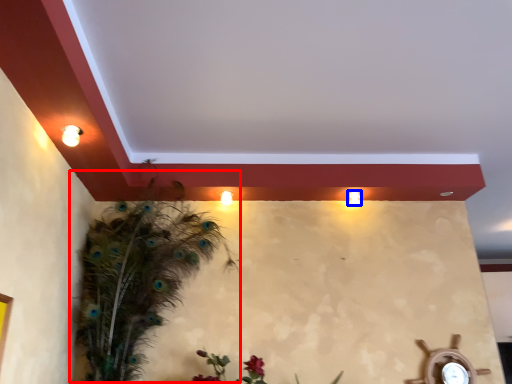
Question: Which point is closer to the camera, bird (highlighted by a red box) or light (highlighted by a blue box)?

Choices:
 (A) bird
 (B) light

Answer: (A)